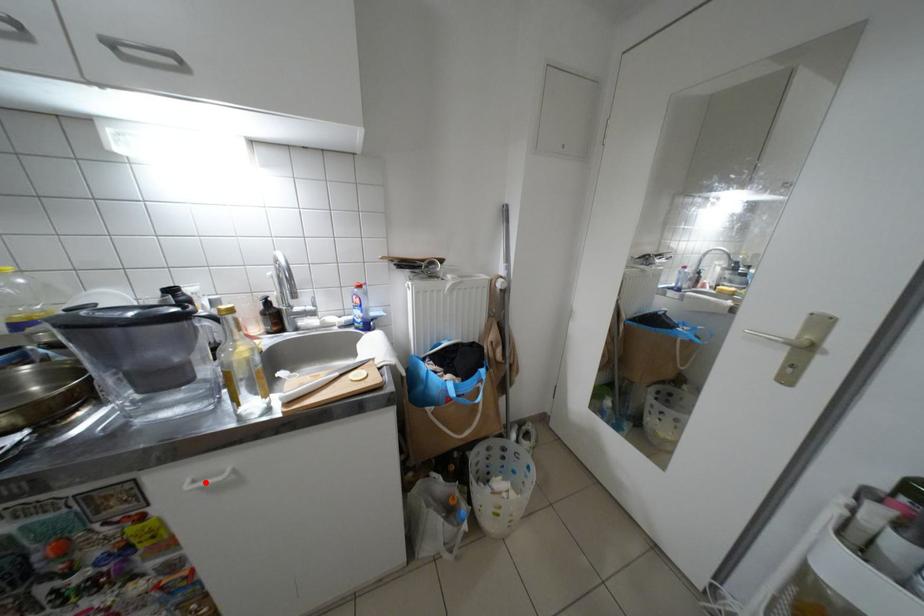
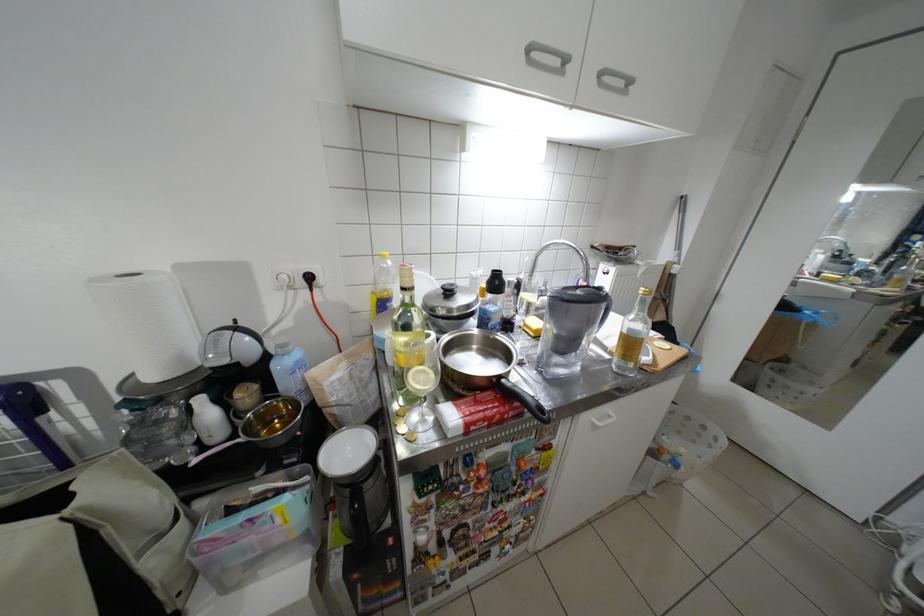
Question: I am providing you with two images of the same scene from different viewpoints. A red point is shown in image1. For the corresponding object point in image2, is it positioned nearer or farther from the camera?

Choices:
 (A) Nearer
 (B) Farther

Answer: (B)